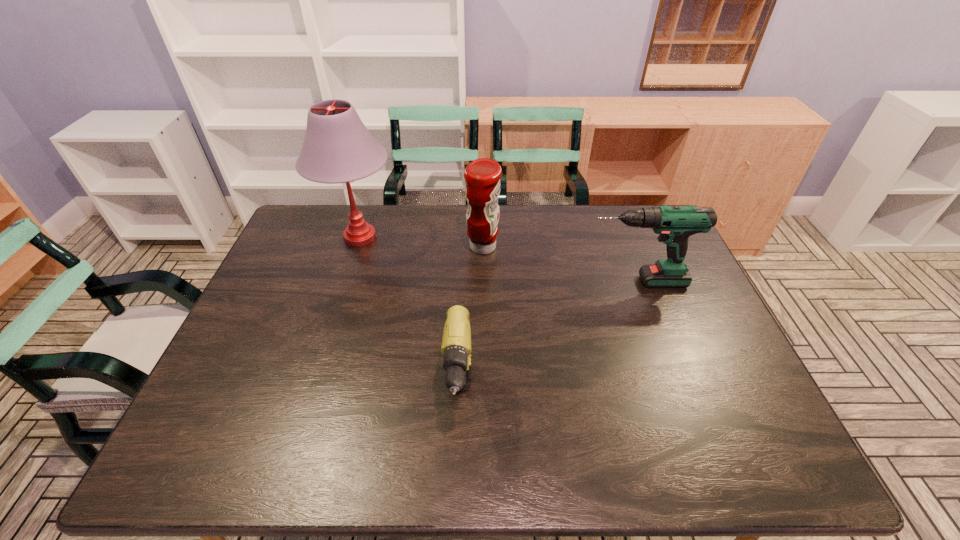
Locate an element on the screen. The image size is (960, 540). free space located on the handle side of the rightmost object is located at coordinates (495, 281).

You are a GUI agent. You are given a task and a screenshot of the screen. Output one action in this format:
    pyautogui.click(x=<x>, y=<y>)
    Task: Click on the free spot located 0.270m on the handle side of the rightmost object
    Image resolution: width=960 pixels, height=540 pixels.
    Given the screenshot: What is the action you would take?
    pyautogui.click(x=495, y=281)

You are a GUI agent. You are given a task and a screenshot of the screen. Output one action in this format:
    pyautogui.click(x=<x>, y=<y>)
    Task: Click on the vacant space located 0.060m on the handle side of the shortest object
    The width and height of the screenshot is (960, 540).
    Given the screenshot: What is the action you would take?
    pyautogui.click(x=456, y=472)

The height and width of the screenshot is (540, 960). What are the coordinates of `table lamp at the far edge` in the screenshot? It's located at (338, 148).

Identify the location of condiment that is positioned at the far edge. This screenshot has height=540, width=960. [482, 176].

In order to click on object situated at the near edge in this screenshot , I will do `click(456, 342)`.

You are a GUI agent. You are given a task and a screenshot of the screen. Output one action in this format:
    pyautogui.click(x=<x>, y=<y>)
    Task: Click on the object at the left edge
    The image size is (960, 540).
    Given the screenshot: What is the action you would take?
    pyautogui.click(x=338, y=148)

Locate an element on the screen. Image resolution: width=960 pixels, height=540 pixels. object situated at the right edge is located at coordinates (675, 224).

Locate an element on the screen. object that is at the far left corner is located at coordinates 338,148.

I want to click on free space at the far edge of the desktop, so click(580, 210).